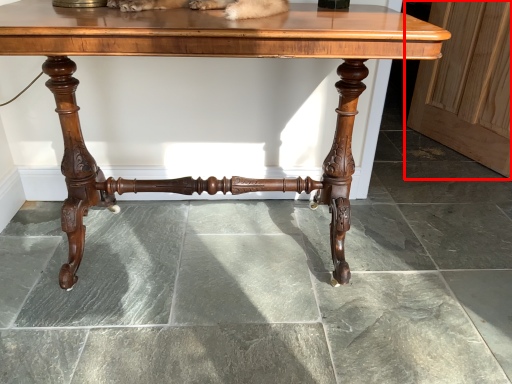
Question: From the image's perspective, where is screen door (annotated by the red box) located relative to table?

Choices:
 (A) above
 (B) below

Answer: (A)